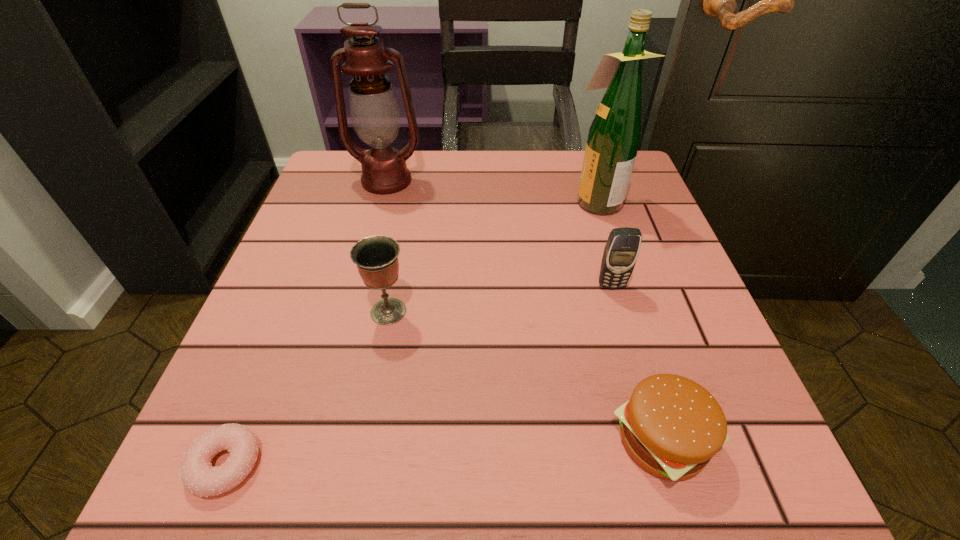
Locate an element on the screen. This screenshot has width=960, height=540. free space located on the back of the third nearest object is located at coordinates (396, 267).

Identify the location of free space located 0.290m on the front face of the cellular telephone. The width and height of the screenshot is (960, 540). (661, 456).

Identify the location of vacant area situated 0.200m on the back of the fifth tallest object. Image resolution: width=960 pixels, height=540 pixels. (617, 291).

What are the coordinates of `vacant space situated 0.320m on the right of the doughnut` in the screenshot? It's located at (515, 464).

At what (x,y) coordinates should I click in order to perform the action: click on liquor present at the far edge. Please return your answer as a coordinate pair (x, y). The image size is (960, 540). Looking at the image, I should click on (614, 136).

Where is `oil lamp that is at the far edge`? This screenshot has width=960, height=540. oil lamp that is at the far edge is located at coordinates (374, 110).

The width and height of the screenshot is (960, 540). Identify the location of hamburger present at the near edge. (671, 426).

Where is `doughnut present at the near edge`? This screenshot has width=960, height=540. doughnut present at the near edge is located at coordinates (198, 476).

Where is `oil lamp located at the left edge`? oil lamp located at the left edge is located at coordinates (374, 110).

Image resolution: width=960 pixels, height=540 pixels. What are the coordinates of `doughnut at the left edge` in the screenshot? It's located at (198, 476).